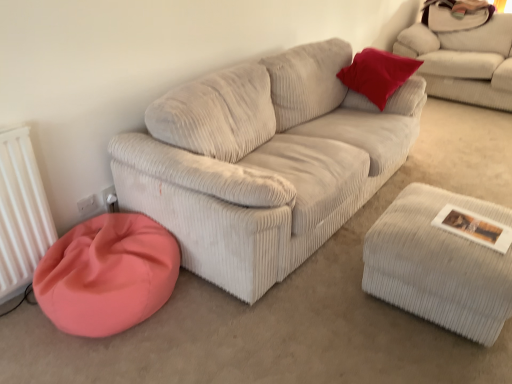
The image size is (512, 384). What do you see at coordinates (439, 264) in the screenshot?
I see `white corduroy stool at lower right` at bounding box center [439, 264].

What are the coordinates of `white corduroy couch at upper right` in the screenshot? It's located at pos(464,61).

Find the location of a particular element. white corduroy stool at lower right is located at coordinates (439, 264).

From the image's perspective, which object appears higher, white corduroy stool at lower right or white corduroy couch at upper right?

white corduroy couch at upper right is shown above in the image.

Is white corduroy stool at lower right far away from white corduroy couch at upper right?

white corduroy stool at lower right is positioned a significant distance from white corduroy couch at upper right.

Is white corduroy stool at lower right closer to the viewer compared to white corduroy couch at upper right?

Yes, it is.

Considering the relative positions of white corduroy stool at lower right and white corduroy couch at upper right in the image provided, is white corduroy stool at lower right to the left of white corduroy couch at upper right from the viewer's perspective?

Yes, white corduroy stool at lower right is to the left of white corduroy couch at upper right.

Can we say white corduroy couch at upper right lies outside white corduroy stool at lower right?

Yes, white corduroy couch at upper right is outside of white corduroy stool at lower right.

At what (x,y) coordinates should I click in order to perform the action: click on stool located below the white corduroy couch at upper right (from the image's perspective). Please return your answer as a coordinate pair (x, y). The width and height of the screenshot is (512, 384). Looking at the image, I should click on (439, 264).

In the scene shown: Which object is closer to the camera, white corduroy couch at upper right or white corduroy stool at lower right?

white corduroy stool at lower right.

Based on the photo, can you confirm if white corduroy couch at upper right is taller than white corduroy stool at lower right?

Indeed, white corduroy couch at upper right has a greater height compared to white corduroy stool at lower right.

Would you say coral fabric bean bag at lower left is to the left or to the right of white corduroy couch at upper right in the picture?

coral fabric bean bag at lower left is positioned on white corduroy couch at upper right's left side.

From a real-world perspective, is coral fabric bean bag at lower left positioned under white corduroy couch at upper right based on gravity?

Yes, from a real-world perspective, coral fabric bean bag at lower left is below white corduroy couch at upper right.

Is coral fabric bean bag at lower left further to the viewer compared to white corduroy couch at upper right?

That is False.

How many degrees apart are the facing directions of coral fabric bean bag at lower left and white corduroy couch at upper right?

90.1 degrees separate the facing orientations of coral fabric bean bag at lower left and white corduroy couch at upper right.

Is white corduroy stool at lower right located outside coral fabric bean bag at lower left?

That's correct, white corduroy stool at lower right is outside of coral fabric bean bag at lower left.

Is white corduroy stool at lower right facing away from coral fabric bean bag at lower left?

No, white corduroy stool at lower right is not facing away from coral fabric bean bag at lower left.

Considering the relative sizes of white corduroy stool at lower right and coral fabric bean bag at lower left in the image provided, is white corduroy stool at lower right taller than coral fabric bean bag at lower left?

Yes.

Which point is more distant from viewer, (362, 280) or (34, 281)?

The point (362, 280) is behind.

Does coral fabric bean bag at lower left turn towards white corduroy stool at lower right?

No, coral fabric bean bag at lower left is not facing towards white corduroy stool at lower right.

From the image's perspective, is coral fabric bean bag at lower left below white corduroy stool at lower right?

Yes, from the image's perspective, coral fabric bean bag at lower left is beneath white corduroy stool at lower right.

What's the angular difference between coral fabric bean bag at lower left and white corduroy stool at lower right's facing directions?

2.31 degrees.

Considering the sizes of objects white corduroy couch at upper right and coral fabric bean bag at lower left in the image provided, who is smaller, white corduroy couch at upper right or coral fabric bean bag at lower left?

coral fabric bean bag at lower left is smaller.

Would you say white corduroy couch at upper right is inside or outside coral fabric bean bag at lower left?

white corduroy couch at upper right exists outside the volume of coral fabric bean bag at lower left.

Considering the sizes of objects white corduroy couch at upper right and coral fabric bean bag at lower left in the image provided, who is taller, white corduroy couch at upper right or coral fabric bean bag at lower left?

white corduroy couch at upper right is taller.

Considering the sizes of white corduroy couch at upper right and coral fabric bean bag at lower left in the image, is white corduroy couch at upper right wider or thinner than coral fabric bean bag at lower left?

Clearly, white corduroy couch at upper right has more width compared to coral fabric bean bag at lower left.

Image resolution: width=512 pixels, height=384 pixels. What are the coordinates of `studio couch on the right of white corduroy stool at lower right` in the screenshot? It's located at (464, 61).

Find the location of a particular element. stool that is below the white corduroy couch at upper right (from the image's perspective) is located at coordinates (439, 264).

Considering their positions, is white corduroy couch at upper right positioned further to white corduroy stool at lower right than coral fabric bean bag at lower left?

white corduroy couch at upper right is further to white corduroy stool at lower right.

Consider the image. Looking at the image, which one is located further to coral fabric bean bag at lower left, white corduroy stool at lower right or white corduroy couch at upper right?

Among the two, white corduroy couch at upper right is located further to coral fabric bean bag at lower left.

Which object lies nearer to the anchor point white corduroy couch at upper right, coral fabric bean bag at lower left or white corduroy stool at lower right?

white corduroy stool at lower right lies closer to white corduroy couch at upper right than the other object.

Looking at the image, which one is located closer to coral fabric bean bag at lower left, white corduroy couch at upper right or white corduroy stool at lower right?

white corduroy stool at lower right is positioned closer to the anchor coral fabric bean bag at lower left.

When comparing their distances from white corduroy couch at upper right, does white corduroy stool at lower right or coral fabric bean bag at lower left seem further?

coral fabric bean bag at lower left is positioned further to the anchor white corduroy couch at upper right.

From the image, which object appears to be farther from white corduroy stool at lower right, coral fabric bean bag at lower left or white corduroy couch at upper right?

white corduroy couch at upper right lies further to white corduroy stool at lower right than the other object.

Find the location of a particular element. The width and height of the screenshot is (512, 384). stool between coral fabric bean bag at lower left and white corduroy couch at upper right from left to right is located at coordinates (439, 264).